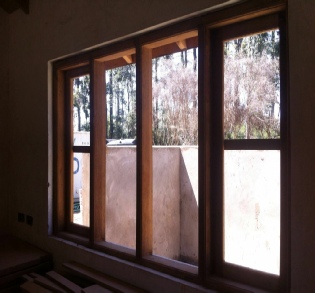
Locate an element on the screen. The image size is (315, 293). plywood is located at coordinates (x=18, y=255).